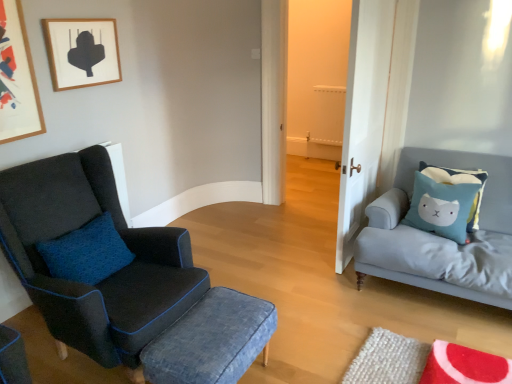
At what (x,y) coordinates should I click in order to perform the action: click on vacant area located to the right-hand side of denim fabric stool at center. Please return your answer as a coordinate pair (x, y). This screenshot has width=512, height=384. Looking at the image, I should click on (309, 357).